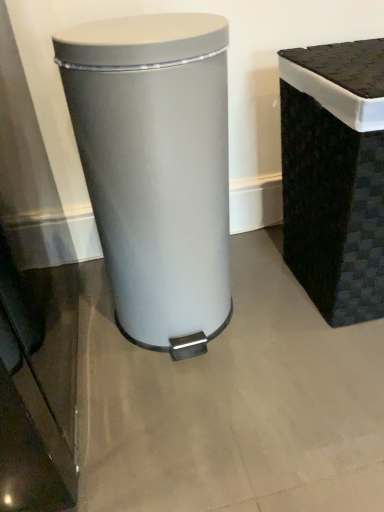
Question: Should I look upward or downward to see black woven basket at right, which is the 2th waste container from left to right?

Choices:
 (A) down
 (B) up

Answer: (B)

Question: Is black woven basket at right, which is the first waste container in right-to-left order, turned away from satin silver trash can at center, which is the first waste container in left-to-right order?

Choices:
 (A) no
 (B) yes

Answer: (A)

Question: Can you confirm if black woven basket at right, which is the first waste container in right-to-left order, is smaller than satin silver trash can at center, which is the first waste container in left-to-right order?

Choices:
 (A) no
 (B) yes

Answer: (A)

Question: Is black woven basket at right, which is the 2th waste container from left to right, oriented towards satin silver trash can at center, the 2th waste container from the right?

Choices:
 (A) yes
 (B) no

Answer: (B)

Question: Is black woven basket at right, which is the 2th waste container from left to right, placed right next to satin silver trash can at center, the 2th waste container from the right?

Choices:
 (A) no
 (B) yes

Answer: (A)

Question: Is black woven basket at right, which is the first waste container in right-to-left order, positioned before satin silver trash can at center, which is the first waste container in left-to-right order?

Choices:
 (A) no
 (B) yes

Answer: (A)

Question: Is black woven basket at right, which is the first waste container in right-to-left order, positioned far away from satin silver trash can at center, the 2th waste container from the right?

Choices:
 (A) no
 (B) yes

Answer: (A)

Question: From a real-world perspective, is satin silver trash can at center, the 2th waste container from the right, positioned over black woven basket at right, which is the first waste container in right-to-left order, based on gravity?

Choices:
 (A) no
 (B) yes

Answer: (B)

Question: Is satin silver trash can at center, the 2th waste container from the right, turned away from black woven basket at right, which is the first waste container in right-to-left order?

Choices:
 (A) no
 (B) yes

Answer: (A)

Question: Is satin silver trash can at center, which is the first waste container in left-to-right order, not inside black woven basket at right, which is the 2th waste container from left to right?

Choices:
 (A) no
 (B) yes

Answer: (B)

Question: Could you tell me if satin silver trash can at center, which is the first waste container in left-to-right order, is turned towards black woven basket at right, which is the first waste container in right-to-left order?

Choices:
 (A) yes
 (B) no

Answer: (B)

Question: Is the depth of satin silver trash can at center, the 2th waste container from the right, less than that of black woven basket at right, which is the first waste container in right-to-left order?

Choices:
 (A) yes
 (B) no

Answer: (A)

Question: Can you see satin silver trash can at center, which is the first waste container in left-to-right order, touching black woven basket at right, which is the 2th waste container from left to right?

Choices:
 (A) no
 (B) yes

Answer: (A)

Question: From a real-world perspective, is black woven basket at right, which is the 2th waste container from left to right, above or below satin silver trash can at center, which is the first waste container in left-to-right order?

Choices:
 (A) below
 (B) above

Answer: (A)